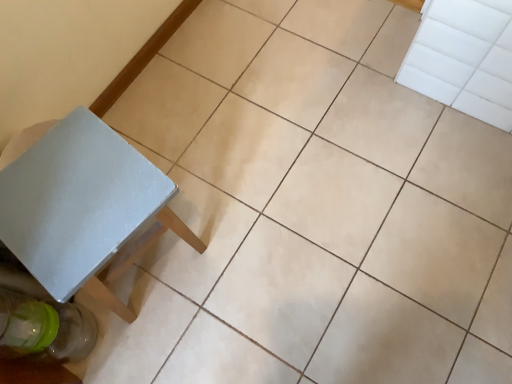
Question: In terms of height, does transparent glass bottle at lower left look taller or shorter compared to white matte table at lower left?

Choices:
 (A) short
 (B) tall

Answer: (A)

Question: Is transparent glass bottle at lower left bigger or smaller than white matte table at lower left?

Choices:
 (A) big
 (B) small

Answer: (B)

Question: Considering the relative positions of transparent glass bottle at lower left and white matte table at lower left in the image provided, is transparent glass bottle at lower left to the left or to the right of white matte table at lower left?

Choices:
 (A) left
 (B) right

Answer: (A)

Question: Considering the relative positions of white matte table at lower left and transparent glass bottle at lower left in the image provided, is white matte table at lower left to the left or to the right of transparent glass bottle at lower left?

Choices:
 (A) right
 (B) left

Answer: (A)

Question: Relative to transparent glass bottle at lower left, is white matte table at lower left in front or behind?

Choices:
 (A) front
 (B) behind

Answer: (A)

Question: From a real-world perspective, relative to transparent glass bottle at lower left, is white matte table at lower left vertically above or below?

Choices:
 (A) below
 (B) above

Answer: (B)

Question: Looking at the image, does white matte table at lower left seem bigger or smaller compared to transparent glass bottle at lower left?

Choices:
 (A) big
 (B) small

Answer: (A)